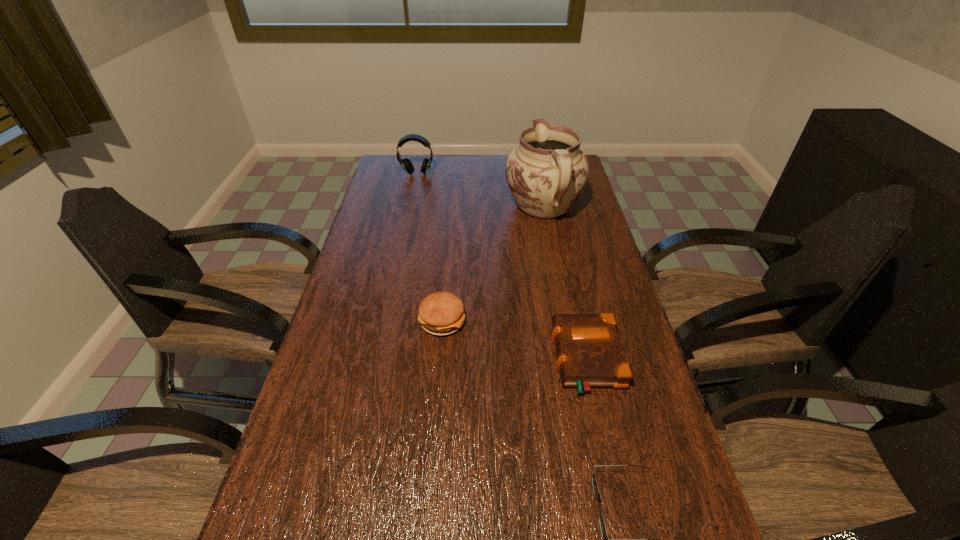
Where is `free region located 0.340m on the ear cups of the earphone`? free region located 0.340m on the ear cups of the earphone is located at coordinates (405, 226).

The height and width of the screenshot is (540, 960). I want to click on free space located on the front of the third tallest object, so click(436, 398).

The width and height of the screenshot is (960, 540). I want to click on vacant space located on the spine side of the Bible, so click(415, 360).

This screenshot has height=540, width=960. I want to click on vacant area situated 0.210m on the spine side of the Bible, so click(x=470, y=360).

Locate an element on the screen. Image resolution: width=960 pixels, height=540 pixels. vacant region located on the spine side of the Bible is located at coordinates (521, 360).

Identify the location of pitcher present at the far edge. Image resolution: width=960 pixels, height=540 pixels. (546, 173).

Locate an element on the screen. This screenshot has height=540, width=960. earphone that is at the far edge is located at coordinates (407, 165).

Where is `object that is positioned at the left edge`? The image size is (960, 540). object that is positioned at the left edge is located at coordinates (407, 165).

Image resolution: width=960 pixels, height=540 pixels. In order to click on pitcher at the right edge in this screenshot , I will do `click(546, 173)`.

Where is `Bible located in the right edge section of the desktop`? The width and height of the screenshot is (960, 540). Bible located in the right edge section of the desktop is located at coordinates (589, 351).